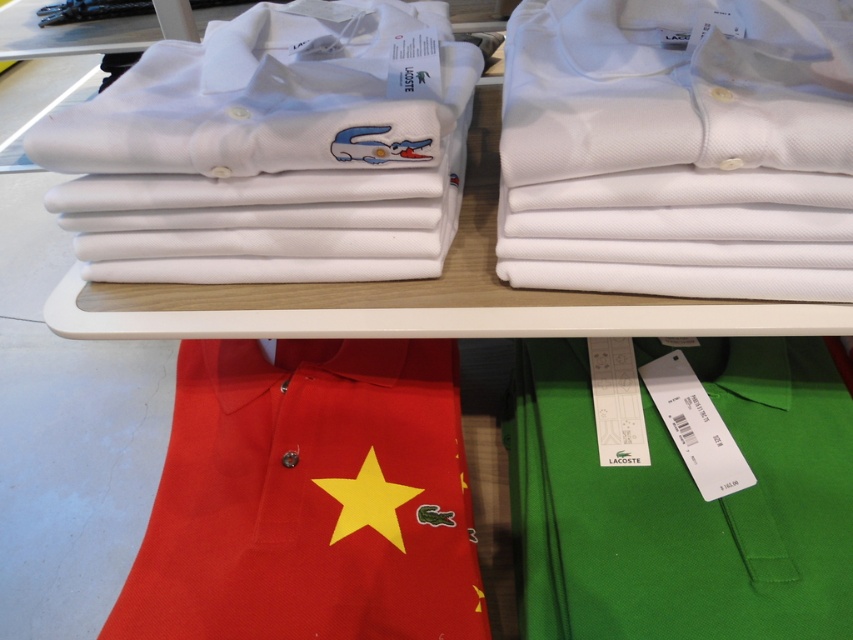
You are a store employee who needs to place a new tag on the shelf at point (390,227). The tag you have is 2 inches thick. Will the tag fit at that point without overlapping other items?

The distance of point (390,227) from camera is 23.60 inches. Since the tag is only 2 inches thick, there is sufficient space at that point to place the tag without overlapping other items.

You are a store employee who needs to retrieve a polo shirt from the shelf. The camera is positioned at your eye level. Can you reach the point where the polo shirt is located at point (x=177, y=404) without needing a ladder?

The point (x=177, y=404) is 33.25 inches away from the camera, so yes, you can reach it without a ladder since it is within arm reach.

You are a customer at a clothing store and see the white cotton shirt at upper left and the red cotton polo shirt at lower left on the shelf. Which shirt is positioned higher on the shelf?

The white cotton shirt at upper left is positioned higher on the shelf than the red cotton polo shirt at lower left.